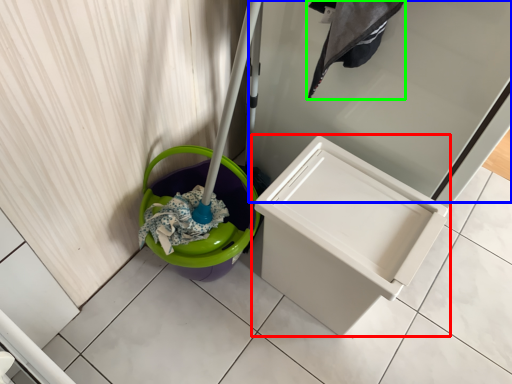
Question: Which is farther away from waste container (highlighted by a red box)? screen door (highlighted by a blue box) or laundry (highlighted by a green box)?

Choices:
 (A) screen door
 (B) laundry

Answer: (B)